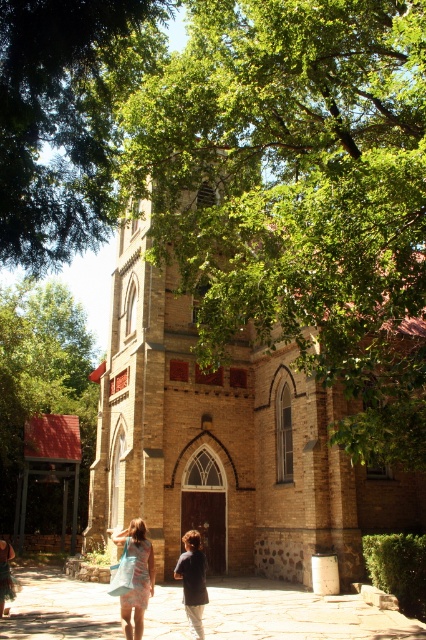
You are standing in front of the historic brick church and notice two points marked on the ground. The first point is labeled as point (86,161) and the second as point (54,298). If you want to walk towards the bell tower, which point should you step on first?

Point (86,161) is in front of point (54,298), so you should step on point (86,161) first to be closer to the bell tower.

You are standing at the entrance of the historic brick church and want to take a photo of the green leafy tree at upper center and the paved stone pathway at center. Which object should you focus on first to ensure both are in clear view?

You should focus on the green leafy tree at upper center first because it is closer to the viewer than the paved stone pathway at center, so adjusting focus from near to far will help both be in clear view.